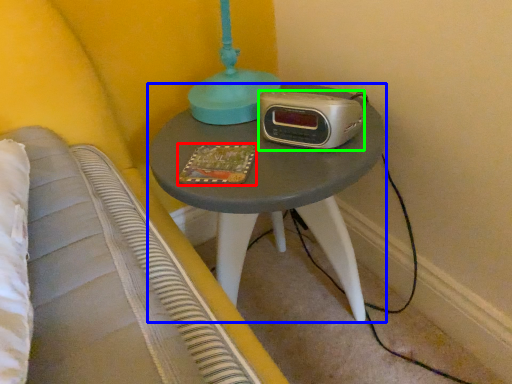
Question: Which object is the closest to the book (highlighted by a red box)? Choose among these: nightstand (highlighted by a blue box) or stereo (highlighted by a green box).

Choices:
 (A) nightstand
 (B) stereo

Answer: (B)